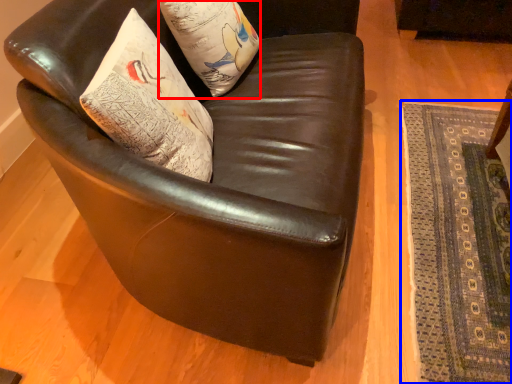
Question: Which of the following is the closest to the observer, pillow (highlighted by a red box) or mat (highlighted by a blue box)?

Choices:
 (A) pillow
 (B) mat

Answer: (B)